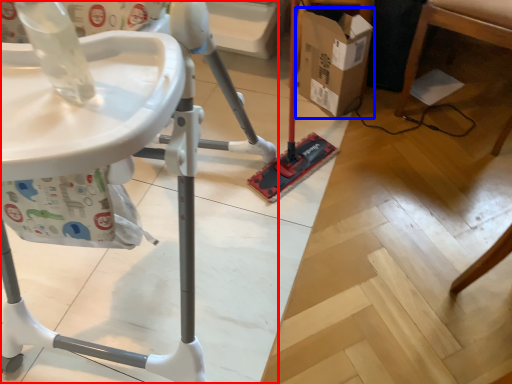
Question: Which point is further to the camera, furniture (highlighted by a red box) or cardboard box (highlighted by a blue box)?

Choices:
 (A) furniture
 (B) cardboard box

Answer: (B)